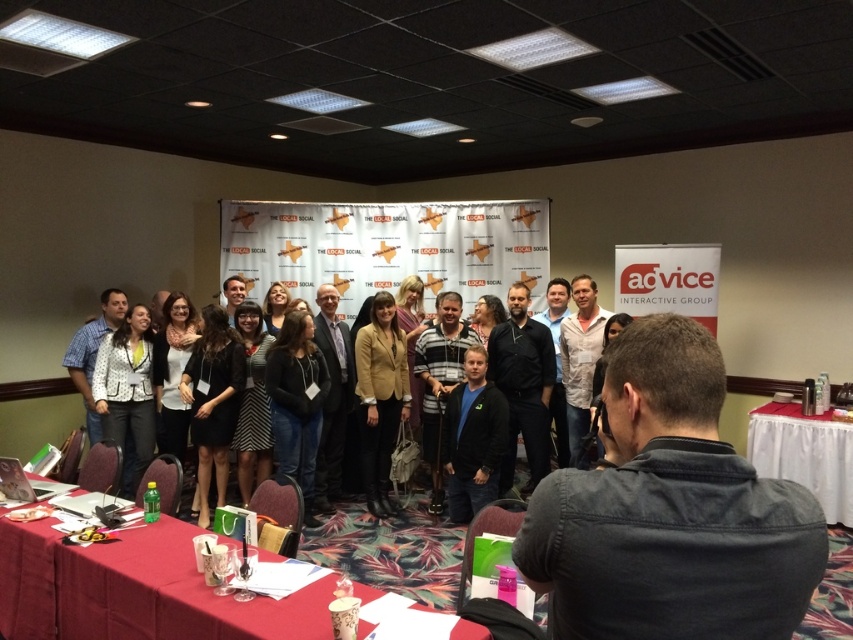
You are organizing a small event and need to determine if the white dotted blazer at center can be placed on the smooth red tablecloth at lower left without hanging over the edges. Based on their sizes, will it fit?

The smooth red tablecloth at lower left is wider than the white dotted blazer at center, so the blazer will fit on the tablecloth without overhanging.

You are standing in the conference room and want to take a photo of the point at coordinates (442, 317). If your camera has a maximum focus range of 15 feet, will you be able to capture the point clearly?

The point at coordinates (442, 317) is 15.91 feet away from the viewer. Since this distance exceeds the camera maximum focus range of 15 feet, the point will not be captured clearly.